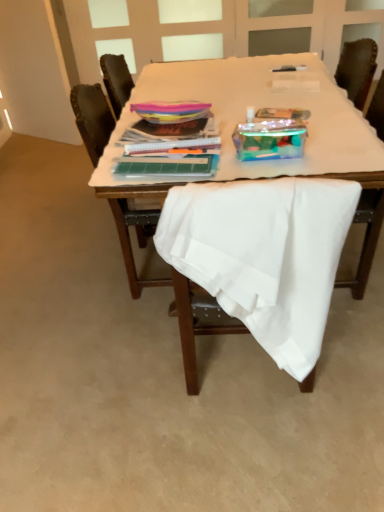
Question: Is white fabric-covered table at center located outside wooden chair at center, acting as the second chair starting from the front?

Choices:
 (A) yes
 (B) no

Answer: (A)

Question: Would you say white fabric-covered table at center is a long distance from wooden chair at center, placed as the 1th chair when sorted from back to front?

Choices:
 (A) yes
 (B) no

Answer: (B)

Question: From the image's perspective, would you say white fabric-covered table at center is shown under wooden chair at center, placed as the 1th chair when sorted from back to front?

Choices:
 (A) no
 (B) yes

Answer: (A)

Question: Is white fabric-covered table at center facing towards wooden chair at center, placed as the 1th chair when sorted from back to front?

Choices:
 (A) yes
 (B) no

Answer: (B)

Question: From a real-world perspective, is white fabric-covered table at center physically above wooden chair at center, placed as the 1th chair when sorted from back to front?

Choices:
 (A) no
 (B) yes

Answer: (B)

Question: In terms of width, does white fabric chair at center, marked as the 2th chair in a back-to-front arrangement, look wider or thinner when compared to white fabric-covered table at center?

Choices:
 (A) thin
 (B) wide

Answer: (A)

Question: Does point (291, 326) appear closer or farther from the camera than point (203, 93)?

Choices:
 (A) closer
 (B) farther

Answer: (A)

Question: From the image's perspective, is white fabric chair at center, marked as the 2th chair in a back-to-front arrangement, above or below white fabric-covered table at center?

Choices:
 (A) above
 (B) below

Answer: (B)

Question: Based on their sizes in the image, would you say white fabric chair at center, the 1th chair viewed from the front, is bigger or smaller than white fabric-covered table at center?

Choices:
 (A) small
 (B) big

Answer: (A)

Question: In the image, is white fabric-covered table at center on the left side or the right side of white fabric chair at center, the 1th chair viewed from the front?

Choices:
 (A) right
 (B) left

Answer: (A)

Question: From their relative heights in the image, would you say white fabric-covered table at center is taller or shorter than white fabric chair at center, marked as the 2th chair in a back-to-front arrangement?

Choices:
 (A) tall
 (B) short

Answer: (B)

Question: Is white fabric-covered table at center in front of or behind white fabric chair at center, marked as the 2th chair in a back-to-front arrangement, in the image?

Choices:
 (A) behind
 (B) front

Answer: (A)

Question: From the image's perspective, is white fabric-covered table at center located above or below white fabric chair at center, the 1th chair viewed from the front?

Choices:
 (A) below
 (B) above

Answer: (B)

Question: Is wooden chair at center, acting as the second chair starting from the front, inside the boundaries of white fabric chair at center, the 1th chair viewed from the front, or outside?

Choices:
 (A) outside
 (B) inside

Answer: (A)

Question: In terms of height, does wooden chair at center, acting as the second chair starting from the front, look taller or shorter compared to white fabric chair at center, marked as the 2th chair in a back-to-front arrangement?

Choices:
 (A) short
 (B) tall

Answer: (B)